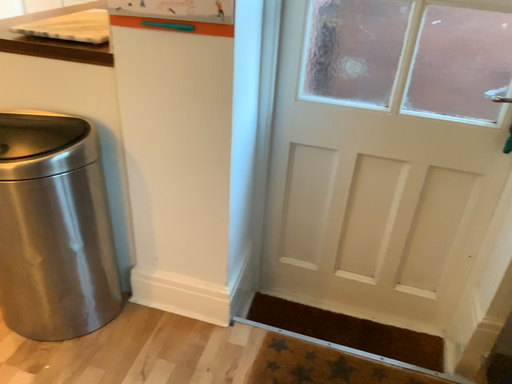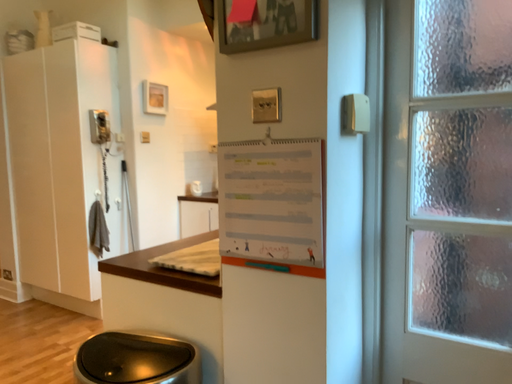
Question: How did the camera likely rotate when shooting the video?

Choices:
 (A) rotated upward
 (B) rotated downward

Answer: (A)